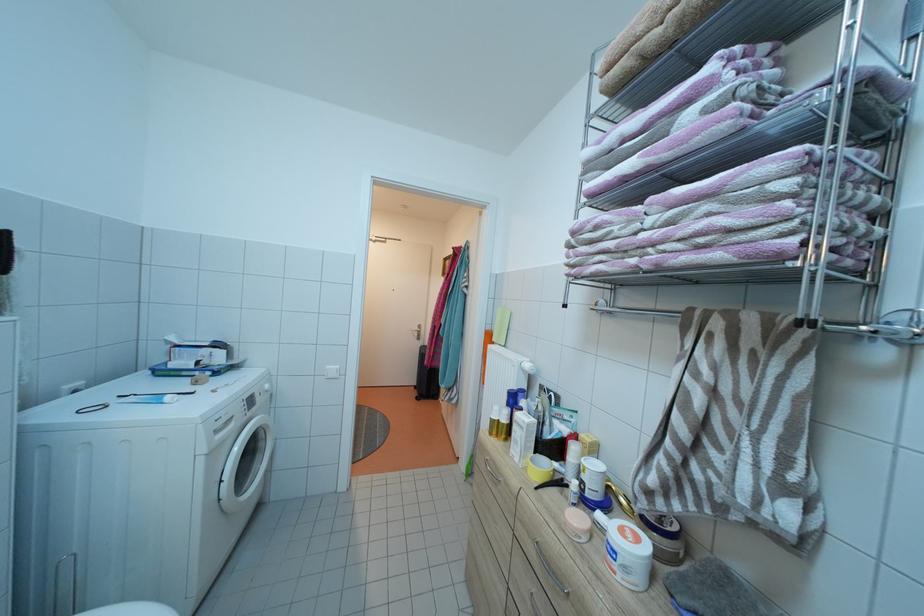
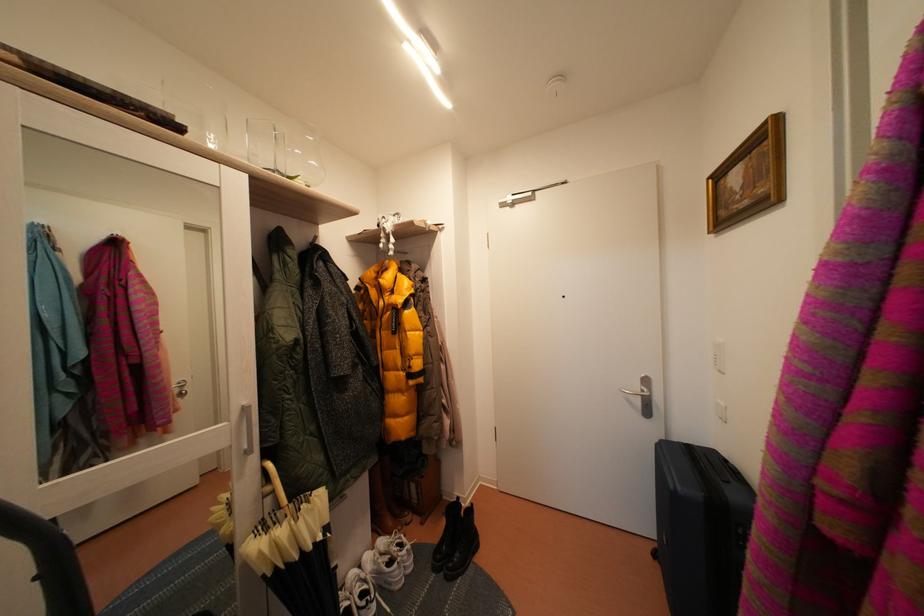
Locate, in the second image, the point that corresponds to [424,334] in the first image.

(645, 392)